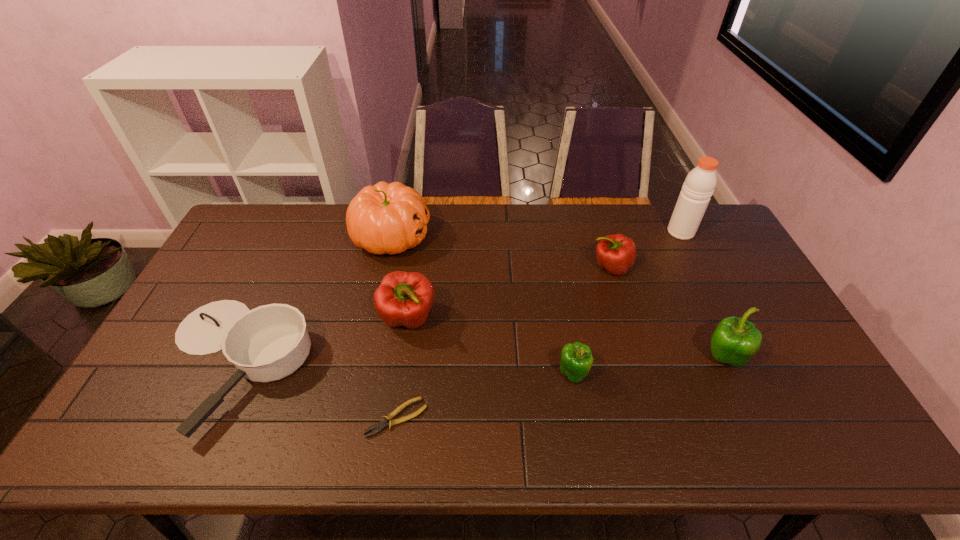
The image size is (960, 540). In order to click on vacant space located 0.140m on the right of the saucepan in this screenshot , I will do `click(363, 363)`.

Where is `vacant space situated on the right of the pliers`? The width and height of the screenshot is (960, 540). vacant space situated on the right of the pliers is located at coordinates (468, 417).

At what (x,y) coordinates should I click in order to perform the action: click on shaker that is at the far edge. Please return your answer as a coordinate pair (x, y). Looking at the image, I should click on (699, 185).

At what (x,y) coordinates should I click in order to perform the action: click on pumpkin that is at the far edge. Please return your answer as a coordinate pair (x, y). This screenshot has height=540, width=960. Looking at the image, I should click on (385, 218).

Find the location of a particular element. Image resolution: width=960 pixels, height=540 pixels. saucepan situated at the near edge is located at coordinates (270, 342).

Where is `pliers present at the near edge`? This screenshot has width=960, height=540. pliers present at the near edge is located at coordinates (379, 426).

What are the coordinates of `object that is at the left edge` in the screenshot? It's located at click(x=270, y=342).

Image resolution: width=960 pixels, height=540 pixels. In order to click on object that is at the right edge in this screenshot , I will do `click(699, 185)`.

Where is `object that is at the near left corner`? The image size is (960, 540). object that is at the near left corner is located at coordinates (270, 342).

Where is `object situated at the far right corner`? object situated at the far right corner is located at coordinates [699, 185].